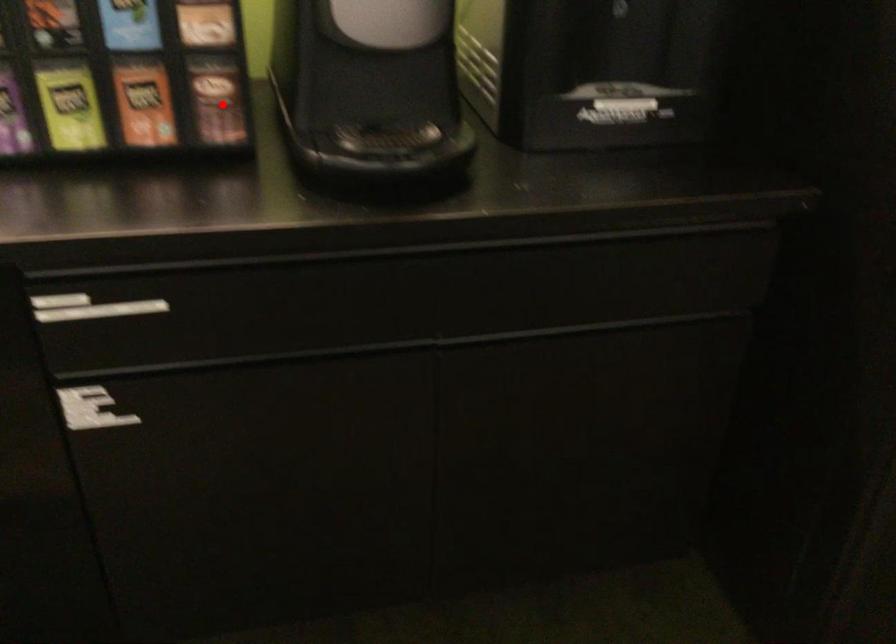
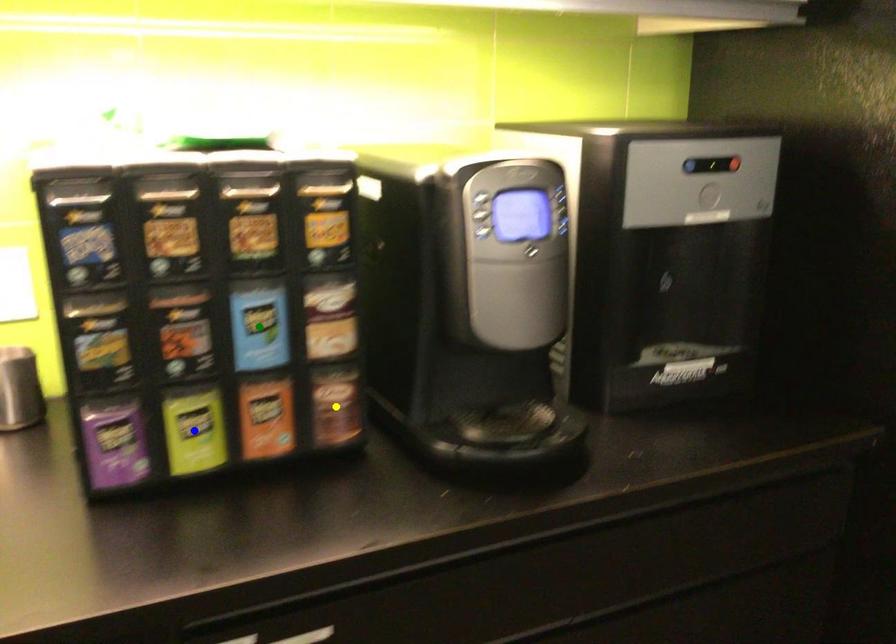
Question: I am providing you with two images of the same scene from different viewpoints. A red point is marked on the first image. You are given multiple points on the second image. Which point in image 2 is actually the same real-world point as the red point in image 1?

Choices:
 (A) green point
 (B) yellow point
 (C) blue point

Answer: (B)